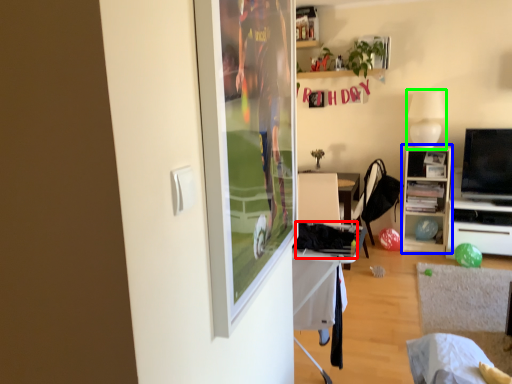
Question: Estimate the real-world distances between objects in this image. Which object is closer to laundry (highlighted by a red box), cabinetry (highlighted by a blue box) or lamp (highlighted by a green box)?

Choices:
 (A) cabinetry
 (B) lamp

Answer: (B)